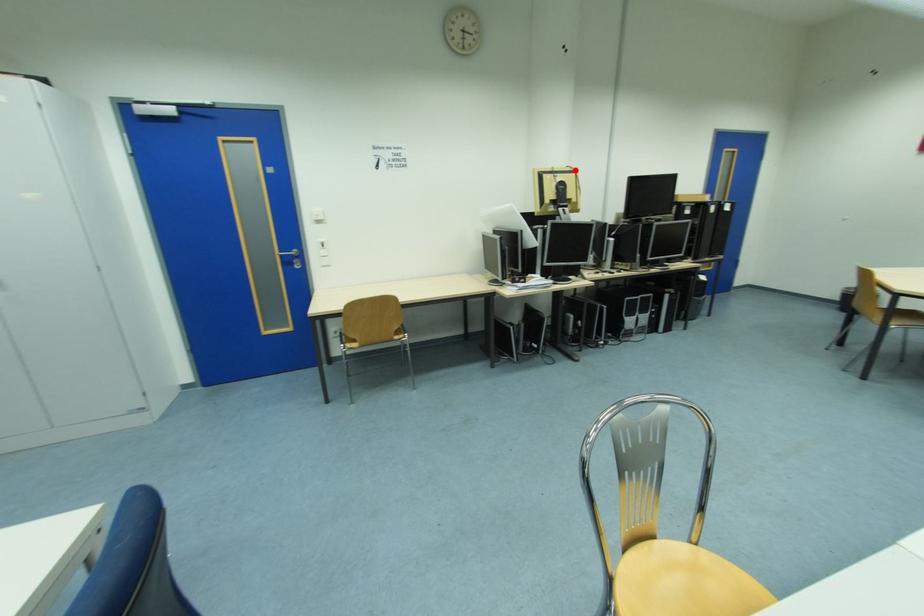
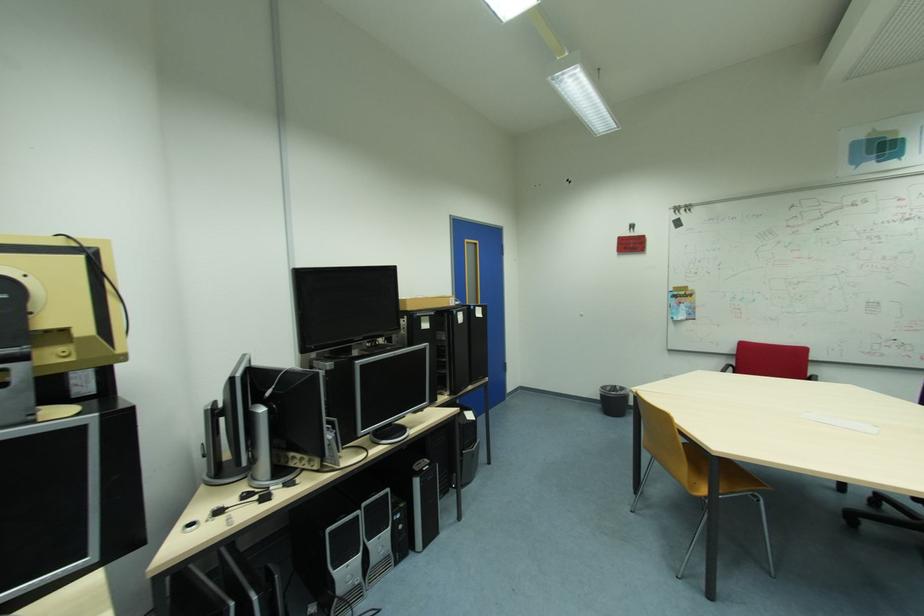
Question: I am providing you with two images of the same scene from different viewpoints. In image1, a red point is highlighted. Considering the same 3D point in image2, which of the following is correct?

Choices:
 (A) It is closer
 (B) It is farther

Answer: (B)